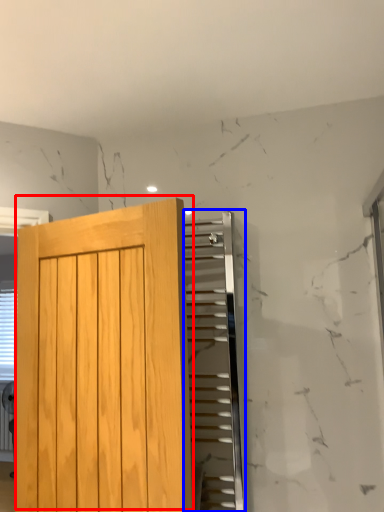
Question: Which point is further to the camera, door (highlighted by a red box) or elevator (highlighted by a blue box)?

Choices:
 (A) door
 (B) elevator

Answer: (B)